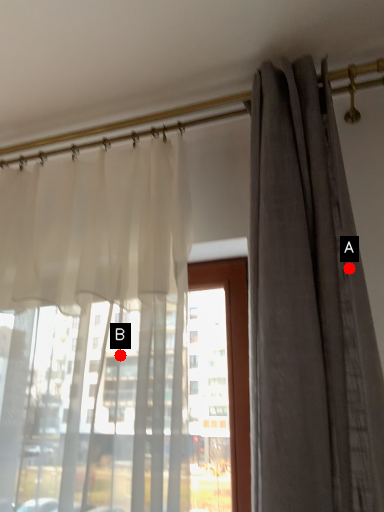
Question: Two points are circled on the image, labeled by A and B beside each circle. Which point is further to the camera?

Choices:
 (A) A is further
 (B) B is further

Answer: (B)